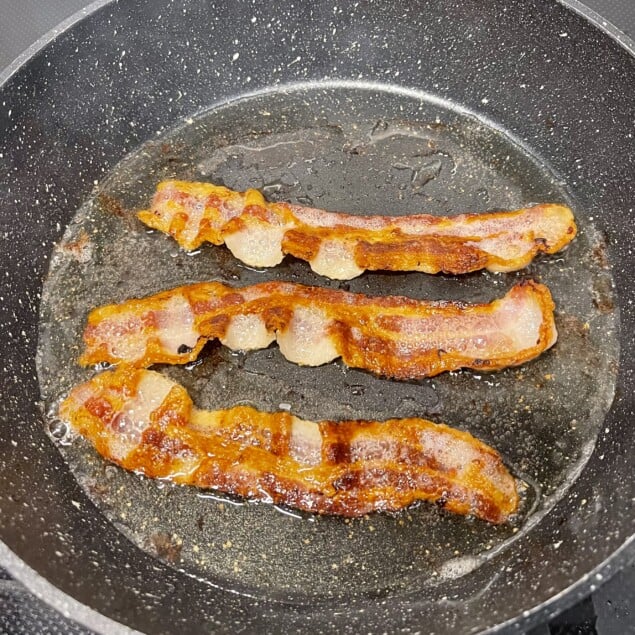
This screenshot has height=635, width=635. Find the location of `white specks on frying pan surface`. white specks on frying pan surface is located at coordinates (559, 540), (74, 500), (15, 441), (60, 552), (18, 331), (58, 224), (235, 55), (489, 98), (568, 29), (601, 455).